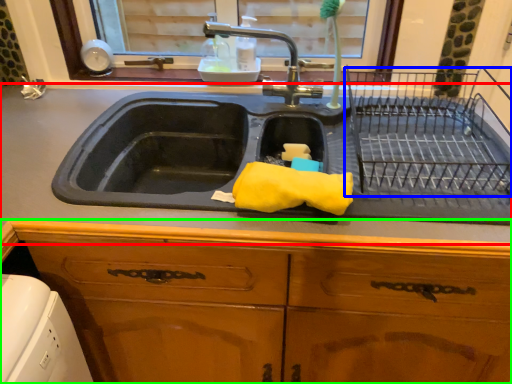
Question: Estimate the real-world distances between objects in this image. Which object is farther from countertop (highlighted by a red box), cage (highlighted by a blue box) or cabinetry (highlighted by a green box)?

Choices:
 (A) cage
 (B) cabinetry

Answer: (A)